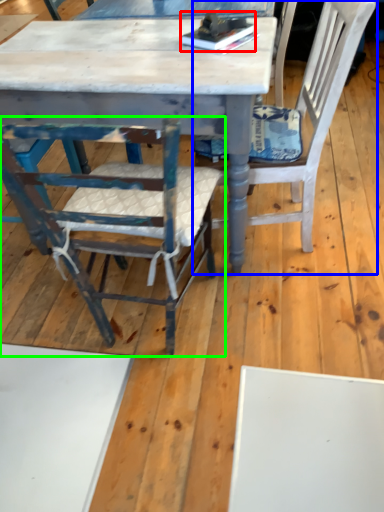
Question: Considering the real-world distances, which object is farthest from book (highlighted by a red box)? chair (highlighted by a blue box) or chair (highlighted by a green box)?

Choices:
 (A) chair
 (B) chair

Answer: (B)